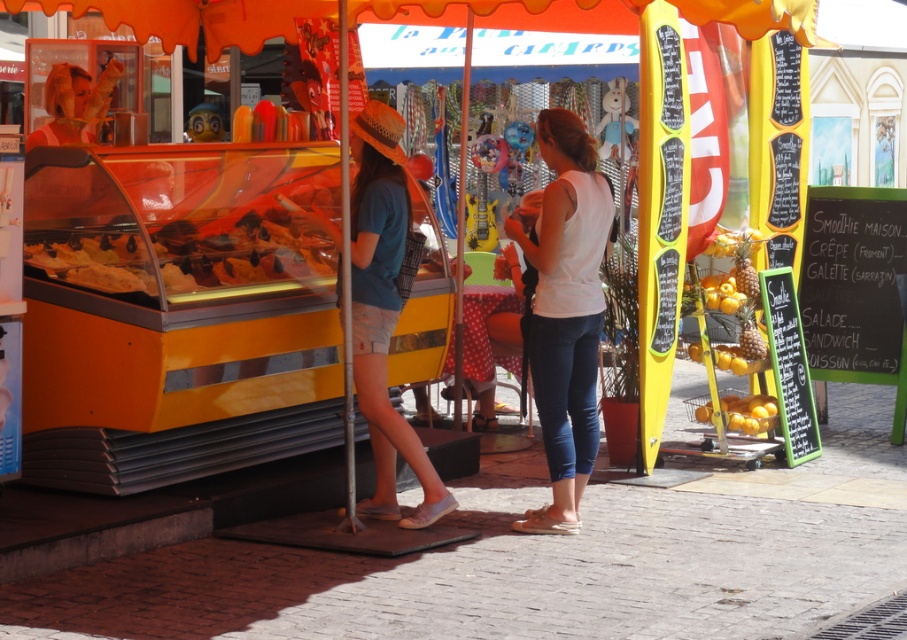
Question: Can you confirm if white matte tank top at center is positioned above yellow matte oranges at right?

Choices:
 (A) yes
 (B) no

Answer: (A)

Question: Among these objects, which one is farthest from the camera?

Choices:
 (A) yellow matte oranges at right
 (B) denim shorts at center
 (C) white matte tank top at center

Answer: (A)

Question: Can you confirm if white matte tank top at center is wider than denim shorts at center?

Choices:
 (A) no
 (B) yes

Answer: (A)

Question: Which of the following is the closest to the observer?

Choices:
 (A) yellow matte oranges at right
 (B) denim shorts at center
 (C) white matte tank top at center

Answer: (B)

Question: Which point is closer to the camera?

Choices:
 (A) white matte tank top at center
 (B) yellow matte oranges at right

Answer: (A)

Question: Is white matte tank top at center further to the viewer compared to denim shorts at center?

Choices:
 (A) yes
 (B) no

Answer: (A)